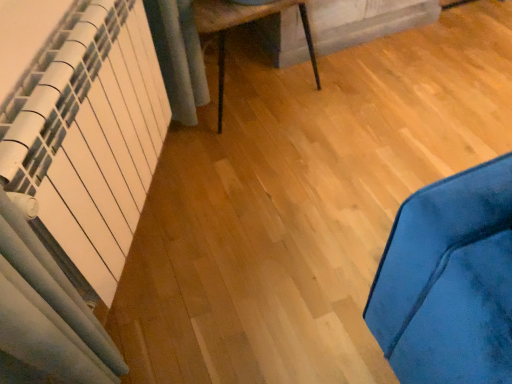
Question: Is wooden table at center at the right side of white matte radiator at left?

Choices:
 (A) yes
 (B) no

Answer: (A)

Question: Is wooden table at center thinner than white matte radiator at left?

Choices:
 (A) yes
 (B) no

Answer: (B)

Question: Is there a large distance between wooden table at center and white matte radiator at left?

Choices:
 (A) yes
 (B) no

Answer: (B)

Question: From the image's perspective, is wooden table at center above white matte radiator at left?

Choices:
 (A) no
 (B) yes

Answer: (B)

Question: Could you tell me if wooden table at center is turned towards white matte radiator at left?

Choices:
 (A) yes
 (B) no

Answer: (B)

Question: Is wooden table at center taller than white matte radiator at left?

Choices:
 (A) no
 (B) yes

Answer: (A)

Question: Are white matte radiator at left and wooden table at center far apart?

Choices:
 (A) no
 (B) yes

Answer: (A)

Question: Is white matte radiator at left further to camera compared to wooden table at center?

Choices:
 (A) no
 (B) yes

Answer: (A)

Question: Could you tell me if white matte radiator at left is turned towards wooden table at center?

Choices:
 (A) no
 (B) yes

Answer: (A)

Question: Does white matte radiator at left have a greater height compared to wooden table at center?

Choices:
 (A) no
 (B) yes

Answer: (B)

Question: Is white matte radiator at left shorter than wooden table at center?

Choices:
 (A) yes
 (B) no

Answer: (B)

Question: From a real-world perspective, is white matte radiator at left located beneath wooden table at center?

Choices:
 (A) yes
 (B) no

Answer: (B)

Question: From a real-world perspective, is wooden table at center physically located above or below white matte radiator at left?

Choices:
 (A) below
 (B) above

Answer: (A)